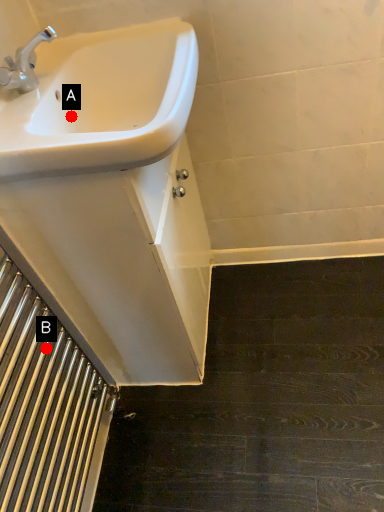
Question: Two points are circled on the image, labeled by A and B beside each circle. Which of the following is the farthest from the observer?

Choices:
 (A) A is further
 (B) B is further

Answer: (A)